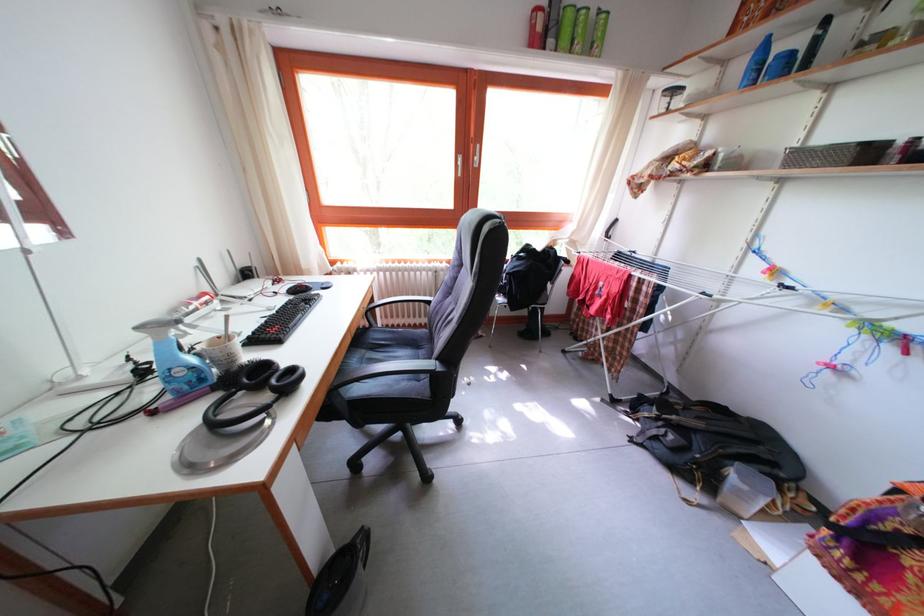
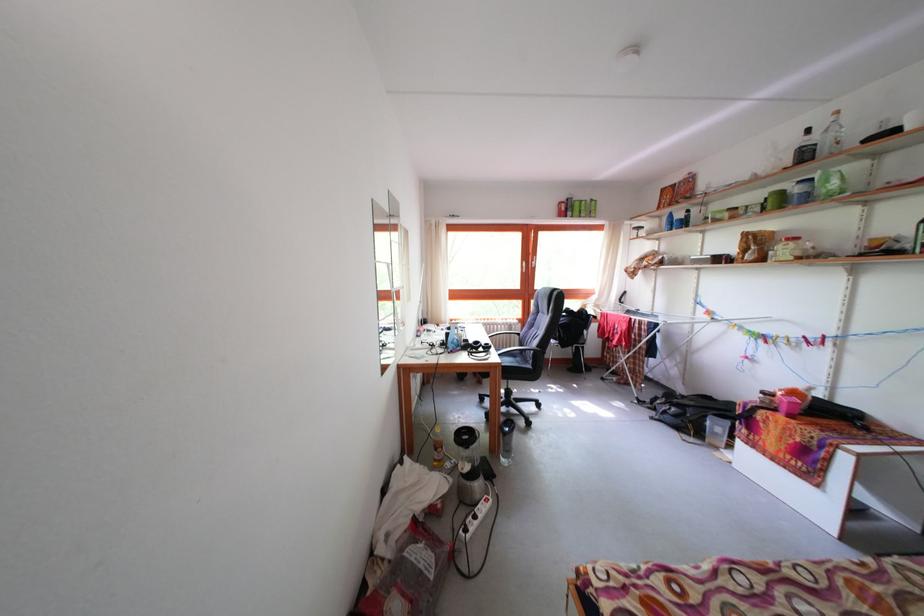
Locate, in the second image, the point that corresponds to the point at 734,69 in the first image.

(667, 224)